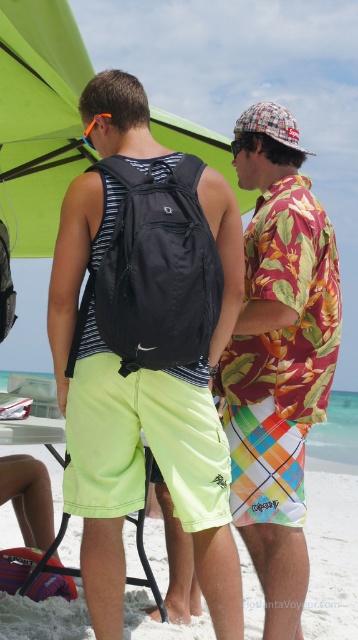
Question: Which point is closer to the camera?

Choices:
 (A) (70, 177)
 (B) (224, 332)
 (C) (301, 397)

Answer: (B)

Question: Considering the relative positions of matte black backpack at center and green fabric umbrella at upper center in the image provided, where is matte black backpack at center located with respect to green fabric umbrella at upper center?

Choices:
 (A) above
 (B) below

Answer: (B)

Question: Which of the following is the closest to the observer?

Choices:
 (A) white sandy beach at lower center
 (B) matte black backpack at center
 (C) green fabric umbrella at upper center

Answer: (B)

Question: Does floral print shirt at center have a larger size compared to green fabric umbrella at upper center?

Choices:
 (A) no
 (B) yes

Answer: (A)

Question: Which object is closer to the camera taking this photo?

Choices:
 (A) green fabric umbrella at upper center
 (B) floral print shirt at center
 (C) matte black backpack at center

Answer: (C)

Question: Does matte black backpack at center have a lesser width compared to green fabric umbrella at upper center?

Choices:
 (A) yes
 (B) no

Answer: (A)